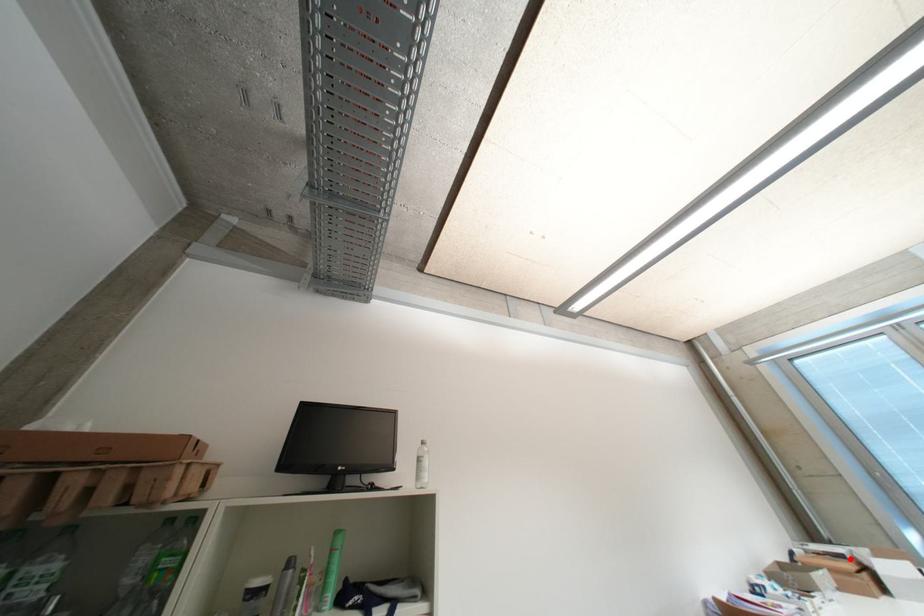
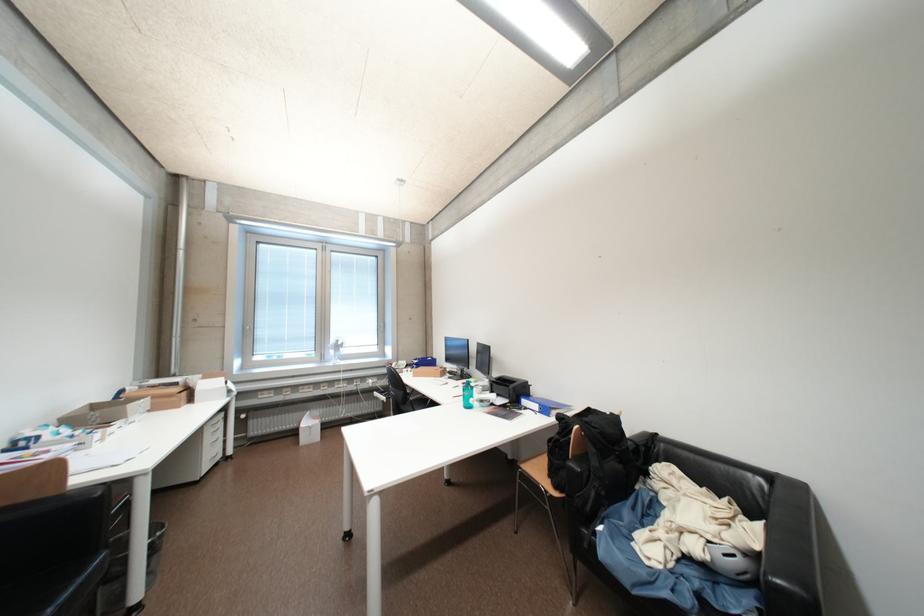
Question: I am providing you with two images of the same scene from different viewpoints. Image1 has a red point marked. In image2, the corresponding 3D location appears at what relative position? Reply with the corresponding letter.

Choices:
 (A) Closer
 (B) Farther

Answer: (B)